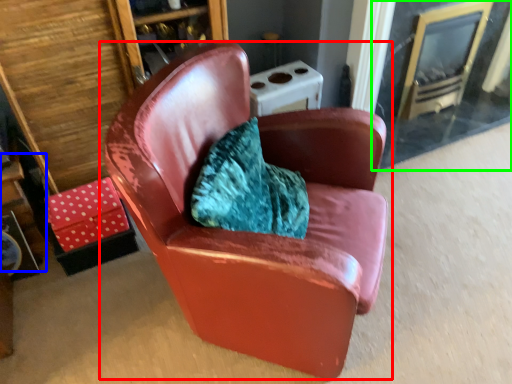
Question: Which is nearer to the chair (highlighted by a red box)? table (highlighted by a blue box) or glass door (highlighted by a green box).

Choices:
 (A) table
 (B) glass door

Answer: (A)